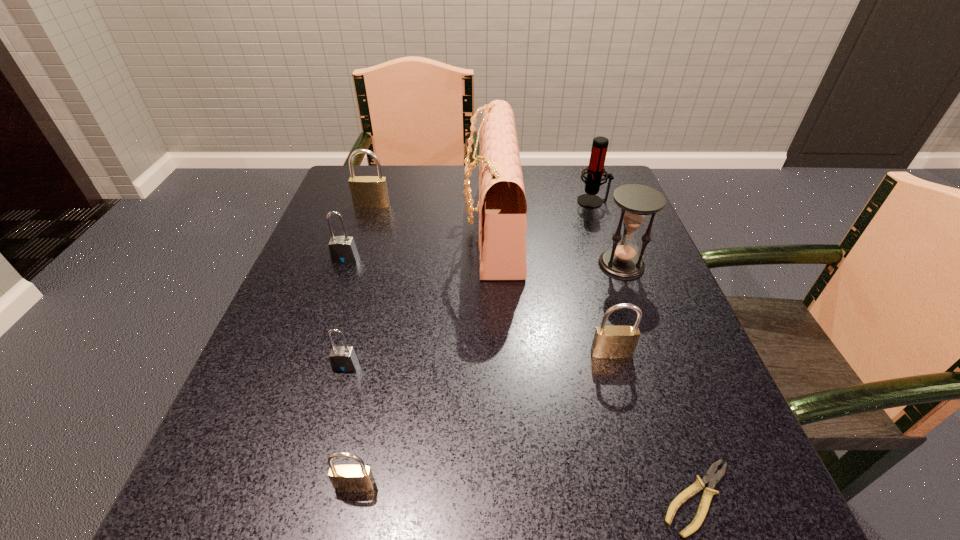
Where is `vacant area that lies between the bigger gray padlock and the sixth object from right to left`? The image size is (960, 540). vacant area that lies between the bigger gray padlock and the sixth object from right to left is located at coordinates (350, 372).

The height and width of the screenshot is (540, 960). In order to click on unoccupied area between the farther gray padlock and the fourth padlock from left to right in this screenshot , I will do `click(350, 372)`.

What are the coordinates of `vacant point located between the rightmost brass padlock and the microphone` in the screenshot? It's located at coord(602,278).

Locate an element on the screen. free space between the second nearest brass padlock and the nearest brass padlock is located at coordinates (483, 420).

The height and width of the screenshot is (540, 960). I want to click on the seventh closest object to the biggest brass padlock, so click(x=346, y=478).

Locate which object is the second closest to the hourglass. Please provide its 2D coordinates. Your answer should be formatted as a tuple, i.e. [(x, y)], where the tuple contains the x and y coordinates of a point satisfying the conditions above.

[(595, 170)]

Identify which padlock is the nearest to the fifth object from left to right. Please provide its 2D coordinates. Your answer should be formatted as a tuple, i.e. [(x, y)], where the tuple contains the x and y coordinates of a point satisfying the conditions above.

[(367, 191)]

Where is `the fourth closest padlock to the leftmost brass padlock`? the fourth closest padlock to the leftmost brass padlock is located at coordinates click(x=346, y=478).

Find the location of a particular element. The width and height of the screenshot is (960, 540). brass padlock object that ranks as the third closest to the black hourglass is located at coordinates (x=346, y=478).

The width and height of the screenshot is (960, 540). Find the location of `the second closest brass padlock to the rightmost padlock`. the second closest brass padlock to the rightmost padlock is located at coordinates (367, 191).